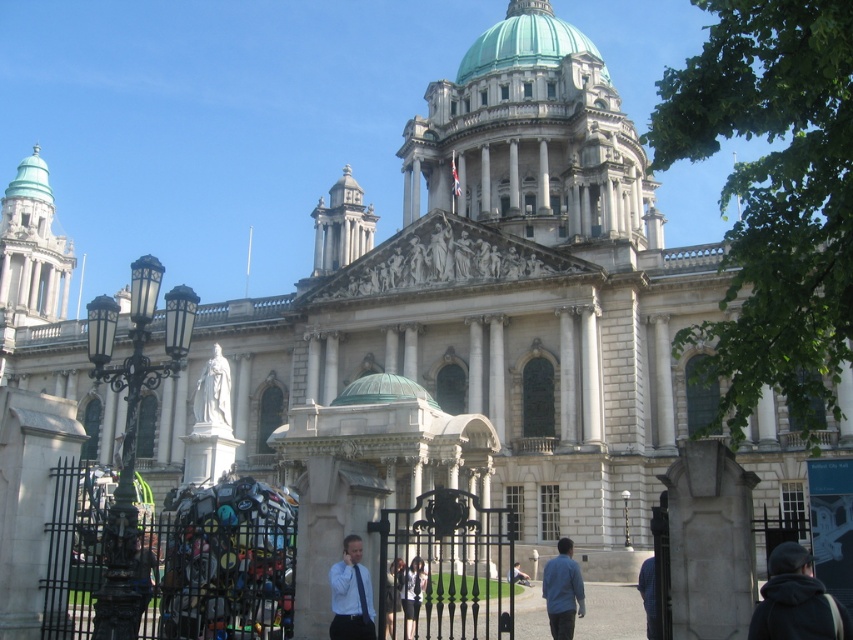
Question: Can you confirm if green domed roof at upper center is positioned to the right of blue denim jacket at lower center?

Choices:
 (A) yes
 (B) no

Answer: (A)

Question: Which object is closer to the camera taking this photo?

Choices:
 (A) dark gray hoodie at lower right
 (B) matte white shirt at center

Answer: (A)

Question: Is green copper dome at center wider than white fabric jacket at center?

Choices:
 (A) no
 (B) yes

Answer: (B)

Question: Which is nearer to the white marble statue at center?

Choices:
 (A) blue denim jacket at lower center
 (B) light blue shirt at center

Answer: (B)

Question: Does green copper dome at center appear on the right side of dark blue dress at center?

Choices:
 (A) no
 (B) yes

Answer: (A)

Question: Estimate the real-world distances between objects in this image. Which object is closer to the dark gray hoodie at lower right?

Choices:
 (A) white fabric jacket at center
 (B) green copper dome at center
 (C) white marble statue at center
 (D) blue denim jacket at lower center

Answer: (D)